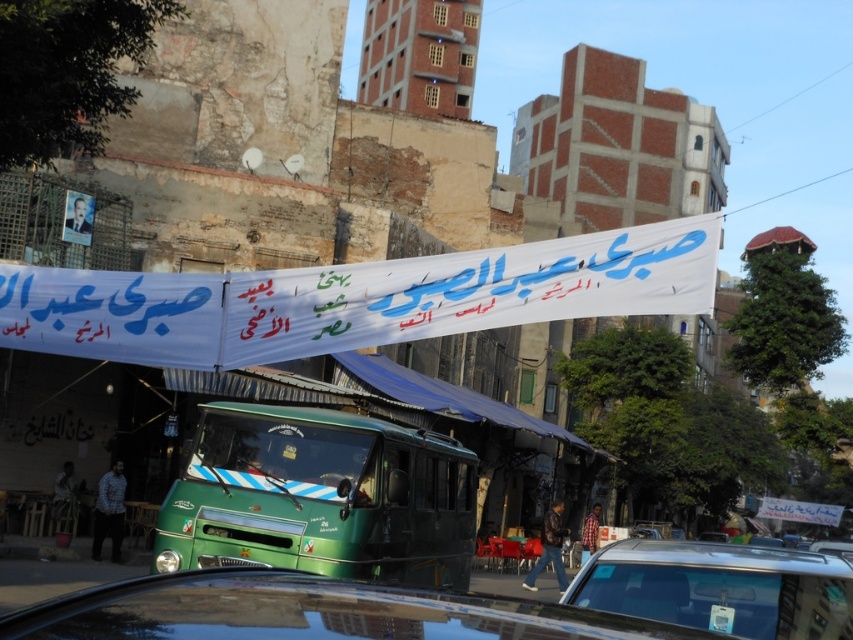
Question: Can you confirm if green matte bus at center is thinner than glossy black car at center?

Choices:
 (A) yes
 (B) no

Answer: (A)

Question: Which of the following is the farthest from the observer?

Choices:
 (A) shiny black car at lower right
 (B) green matte bus at center
 (C) glossy black car at center

Answer: (B)

Question: Which point appears farthest from the camera in this image?

Choices:
 (A) (387, 593)
 (B) (645, 573)
 (C) (331, 458)

Answer: (C)

Question: Based on their relative distances, which object is farther from the glossy black car at center?

Choices:
 (A) shiny black car at lower right
 (B) green matte bus at center

Answer: (B)

Question: Does green matte bus at center have a lesser width compared to glossy black car at center?

Choices:
 (A) yes
 (B) no

Answer: (A)

Question: Does glossy black car at center appear under shiny black car at lower right?

Choices:
 (A) no
 (B) yes

Answer: (B)